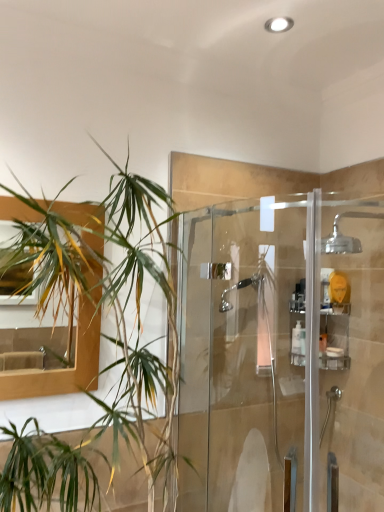
Question: Does chrome metallic showerhead at upper right have a smaller size compared to green leafy plant at left?

Choices:
 (A) yes
 (B) no

Answer: (A)

Question: Is chrome metallic showerhead at upper right facing away from green leafy plant at left?

Choices:
 (A) no
 (B) yes

Answer: (A)

Question: Can you confirm if chrome metallic showerhead at upper right is wider than green leafy plant at left?

Choices:
 (A) no
 (B) yes

Answer: (A)

Question: Are chrome metallic showerhead at upper right and green leafy plant at left beside each other?

Choices:
 (A) no
 (B) yes

Answer: (A)

Question: From a real-world perspective, is chrome metallic showerhead at upper right positioned over green leafy plant at left based on gravity?

Choices:
 (A) yes
 (B) no

Answer: (A)

Question: From the image's perspective, is chrome metallic showerhead at upper right located above green leafy plant at left?

Choices:
 (A) no
 (B) yes

Answer: (B)

Question: Is clear plastic shelf at upper right thinner than white plastic bottle at center?

Choices:
 (A) yes
 (B) no

Answer: (B)

Question: Does clear plastic shelf at upper right appear on the right side of white plastic bottle at center?

Choices:
 (A) no
 (B) yes

Answer: (B)

Question: Are clear plastic shelf at upper right and white plastic bottle at center far apart?

Choices:
 (A) no
 (B) yes

Answer: (A)

Question: Considering the relative positions of clear plastic shelf at upper right and white plastic bottle at center in the image provided, is clear plastic shelf at upper right in front of white plastic bottle at center?

Choices:
 (A) no
 (B) yes

Answer: (B)

Question: Is clear plastic shelf at upper right not within white plastic bottle at center?

Choices:
 (A) no
 (B) yes

Answer: (B)

Question: From a real-world perspective, is clear plastic shelf at upper right positioned under white plastic bottle at center based on gravity?

Choices:
 (A) yes
 (B) no

Answer: (B)

Question: Is clear glass shower door at center positioned in front of chrome metallic showerhead at upper right?

Choices:
 (A) no
 (B) yes

Answer: (B)